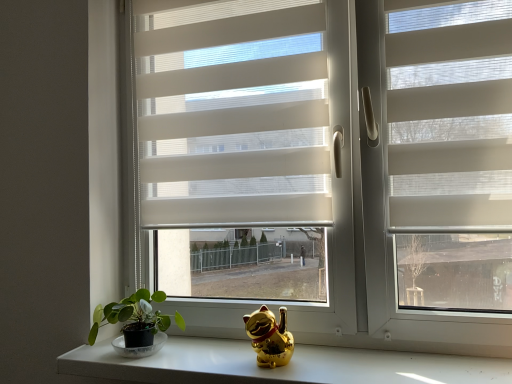
Question: Choose the correct answer: Is white textured blinds at center inside green matte plant at lower left or outside it?

Choices:
 (A) inside
 (B) outside

Answer: (B)

Question: Based on their positions, is white textured blinds at center located to the left or right of green matte plant at lower left?

Choices:
 (A) left
 (B) right

Answer: (B)

Question: Which object is the farthest from the white textured blinds at center?

Choices:
 (A) gold shiny cat at center
 (B) white matte window at center
 (C) gold metallic cat figurine at lower center
 (D) white translucent screen door at right
 (E) green matte plant at lower left

Answer: (C)

Question: Based on their relative distances, which object is farther from the white matte window at center?

Choices:
 (A) white textured blinds at center
 (B) gold metallic cat figurine at lower center
 (C) green matte plant at lower left
 (D) white translucent screen door at right
 (E) gold shiny cat at center

Answer: (C)